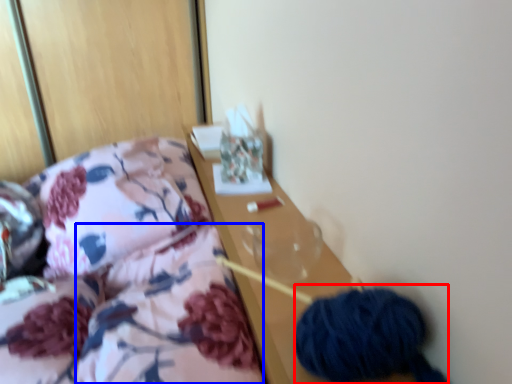
Question: Which object is closer to the camera taking this photo, material (highlighted by a red box) or quilt (highlighted by a blue box)?

Choices:
 (A) material
 (B) quilt

Answer: (B)